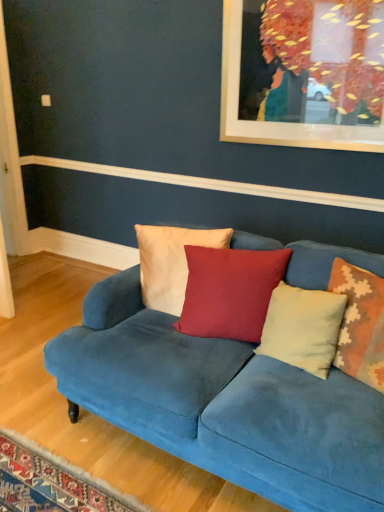
Question: Is beige textured pillow at right, which is the fourth pillow in left-to-right order, at the right side of matte red cushion at center, the 3th pillow from the right?

Choices:
 (A) yes
 (B) no

Answer: (A)

Question: From a real-world perspective, does beige textured pillow at right, which is the fourth pillow in left-to-right order, stand above matte red cushion at center, the 2th pillow positioned from the left?

Choices:
 (A) no
 (B) yes

Answer: (B)

Question: Is beige textured pillow at right, which is counted as the 1th pillow, starting from the right, positioned with its back to matte red cushion at center, the 3th pillow from the right?

Choices:
 (A) yes
 (B) no

Answer: (B)

Question: Considering the relative sizes of beige textured pillow at right, which is counted as the 1th pillow, starting from the right, and matte red cushion at center, the 2th pillow positioned from the left, in the image provided, is beige textured pillow at right, which is counted as the 1th pillow, starting from the right, wider than matte red cushion at center, the 2th pillow positioned from the left,?

Choices:
 (A) no
 (B) yes

Answer: (A)

Question: Is the surface of beige textured pillow at right, which is counted as the 1th pillow, starting from the right, in direct contact with matte red cushion at center, the 2th pillow positioned from the left?

Choices:
 (A) no
 (B) yes

Answer: (A)

Question: Is beige textured pillow at right, which is counted as the 1th pillow, starting from the right, in front of or behind velvet blue couch at center in the image?

Choices:
 (A) behind
 (B) front

Answer: (A)

Question: Would you say beige textured pillow at right, which is the fourth pillow in left-to-right order, is inside or outside velvet blue couch at center?

Choices:
 (A) inside
 (B) outside

Answer: (A)

Question: Based on their positions, is beige textured pillow at right, which is the fourth pillow in left-to-right order, located to the left or right of velvet blue couch at center?

Choices:
 (A) right
 (B) left

Answer: (A)

Question: Is point (357, 340) positioned closer to the camera than point (84, 355)?

Choices:
 (A) farther
 (B) closer

Answer: (B)

Question: Considering the positions of point (301, 317) and point (372, 435), is point (301, 317) closer or farther from the camera than point (372, 435)?

Choices:
 (A) farther
 (B) closer

Answer: (A)

Question: Considering the positions of light beige velvet pillow at center, positioned as the second pillow in right-to-left order, and velvet blue couch at center in the image, is light beige velvet pillow at center, positioned as the second pillow in right-to-left order, bigger or smaller than velvet blue couch at center?

Choices:
 (A) small
 (B) big

Answer: (A)

Question: In terms of height, does light beige velvet pillow at center, which ranks as the third pillow in left-to-right order, look taller or shorter compared to velvet blue couch at center?

Choices:
 (A) short
 (B) tall

Answer: (A)

Question: From a real-world perspective, is light beige velvet pillow at center, which ranks as the third pillow in left-to-right order, above or below velvet blue couch at center?

Choices:
 (A) above
 (B) below

Answer: (A)

Question: In terms of size, does beige textured pillow at right, which is counted as the 1th pillow, starting from the right, appear bigger or smaller than light beige velvet pillow at center, which ranks as the third pillow in left-to-right order?

Choices:
 (A) small
 (B) big

Answer: (B)

Question: From the image's perspective, is beige textured pillow at right, which is the fourth pillow in left-to-right order, above or below light beige velvet pillow at center, positioned as the second pillow in right-to-left order?

Choices:
 (A) above
 (B) below

Answer: (A)